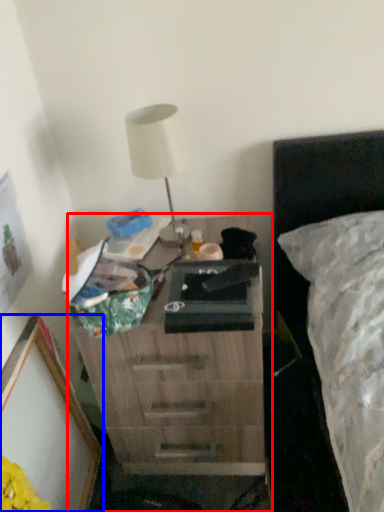
Question: Which object appears closest to the camera in this image, nightstand (highlighted by a red box) or picture frame (highlighted by a blue box)?

Choices:
 (A) nightstand
 (B) picture frame

Answer: (B)